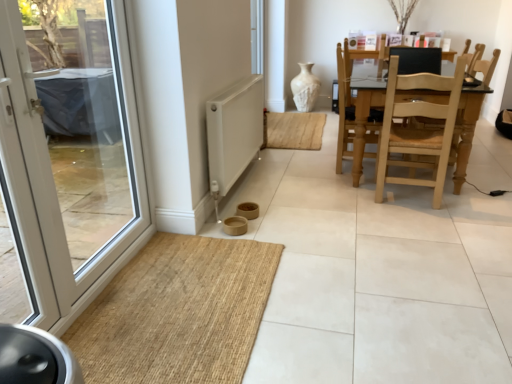
The width and height of the screenshot is (512, 384). What are the coordinates of `empty space that is to the right of white matte radiator at lower center` in the screenshot? It's located at (307, 188).